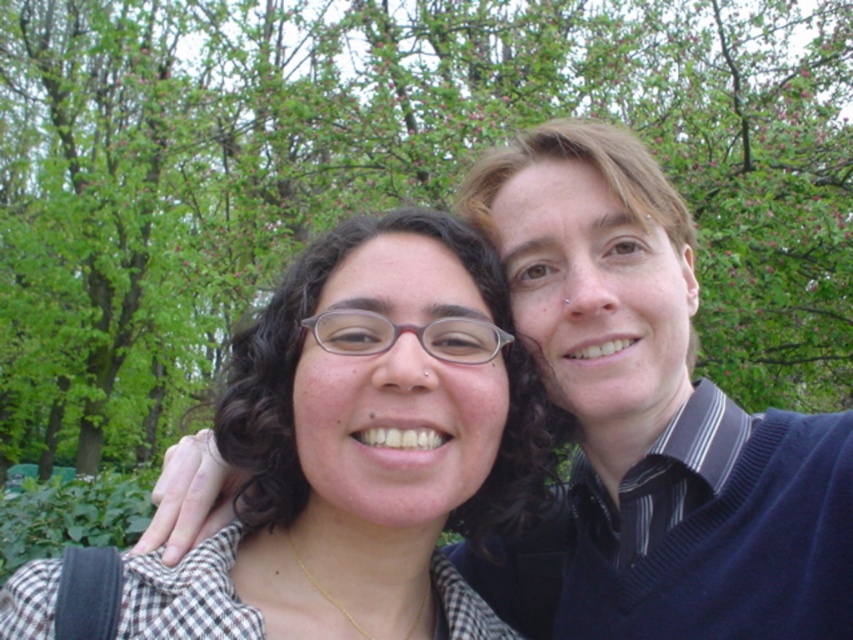
The height and width of the screenshot is (640, 853). Describe the element at coordinates (361, 448) in the screenshot. I see `matte checkered shirt at center` at that location.

How distant is matte checkered shirt at center from blue sweater at upper right?

matte checkered shirt at center and blue sweater at upper right are 9.44 inches apart.

Image resolution: width=853 pixels, height=640 pixels. What do you see at coordinates (361, 448) in the screenshot?
I see `matte checkered shirt at center` at bounding box center [361, 448].

Where is `matte checkered shirt at center`? matte checkered shirt at center is located at coordinates (361, 448).